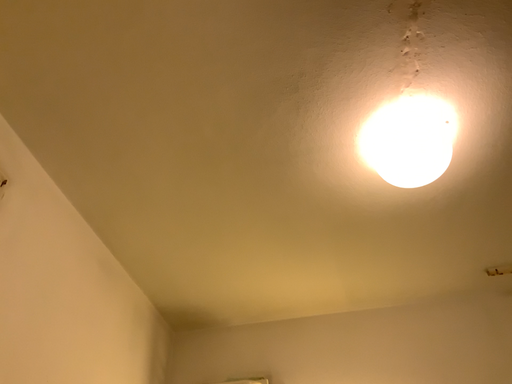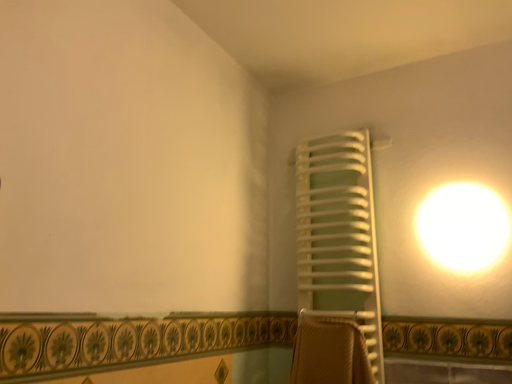
Question: Which way did the camera rotate in the video?

Choices:
 (A) rotated right
 (B) rotated left

Answer: (B)